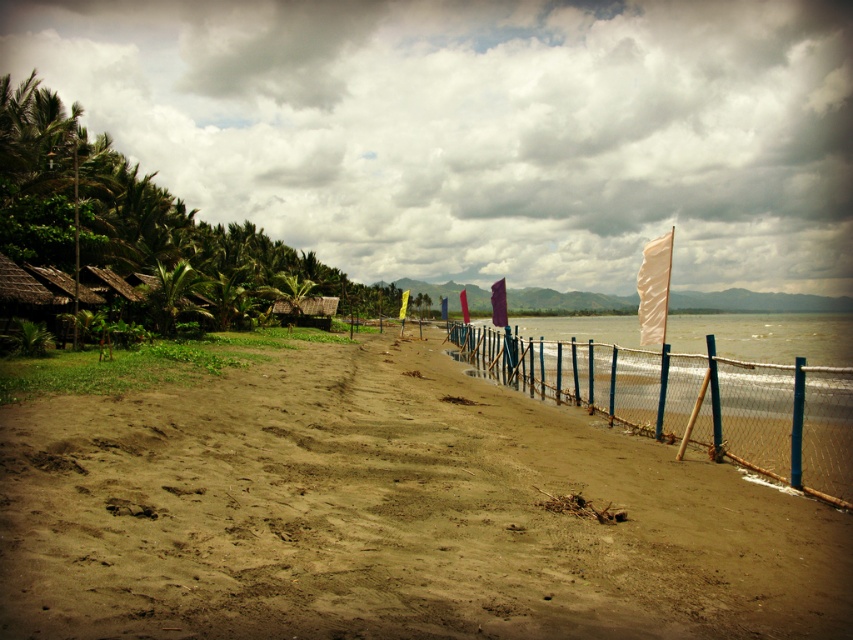
Based on the photo, you are standing on the beach and want to walk to the blue wire mesh fence at center. Which direction should you move relative to the brown sandy dirt field at center?

The blue wire mesh fence at center is above the brown sandy dirt field at center, so you should move upwards from the brown sandy dirt field at center to reach the blue wire mesh fence at center.

You are a photographer trying to capture the entire scene of the blue wire mesh fence at center and the translucent plastic water at center in one shot. Which object should you focus on first to ensure both are in frame without moving the camera?

You should focus on the translucent plastic water at center first because it occupies more space than the blue wire mesh fence at center, so centering it will help include both in the frame.